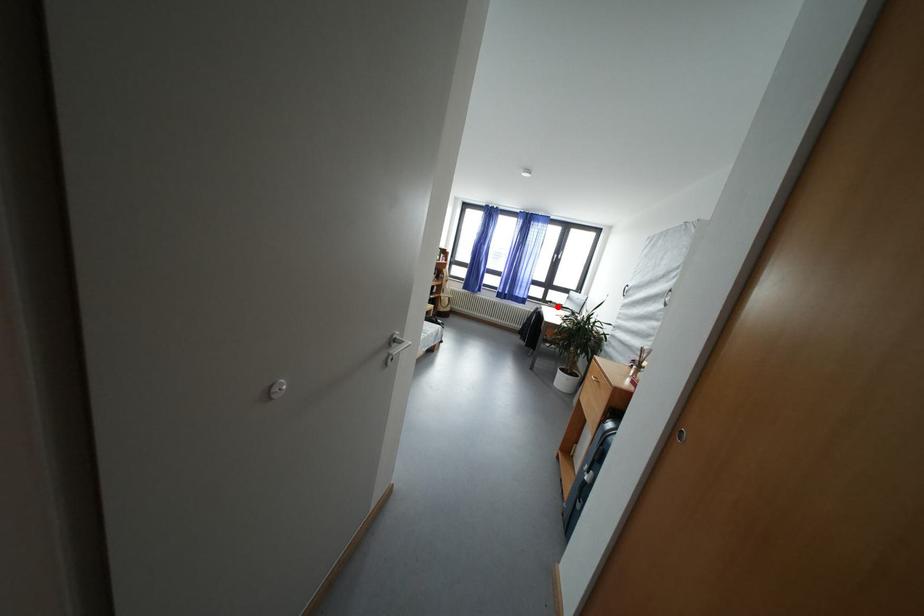
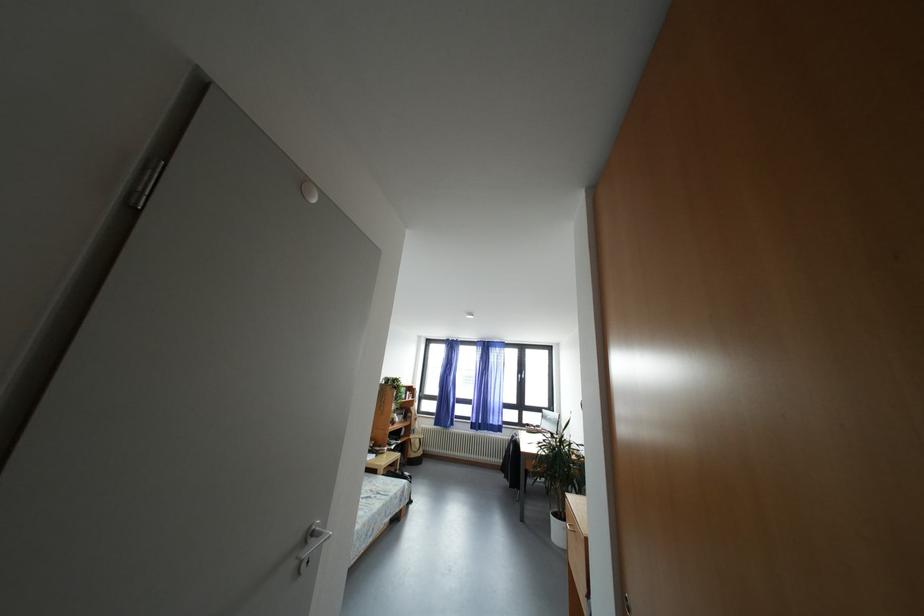
Where in the second image is the point corresponding to the highlighted location from the first image?

(533, 430)